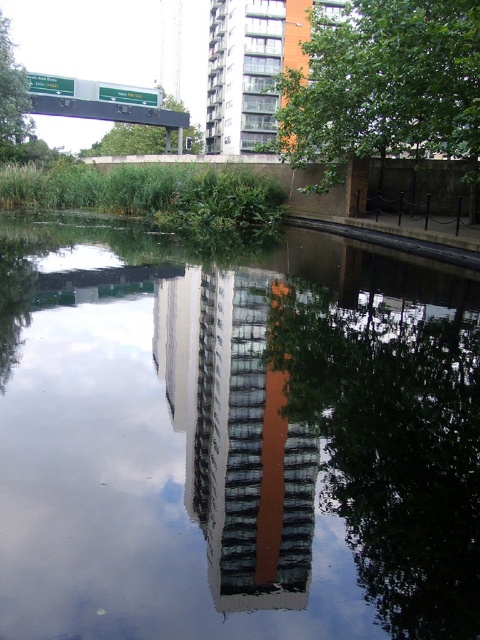
What do you see at coordinates (233, 440) in the screenshot? Image resolution: width=480 pixels, height=640 pixels. I see `transparent glass water at center` at bounding box center [233, 440].

Which is above, transparent glass water at center or green leafy tree at center?

green leafy tree at center is higher up.

Locate an element on the screen. transparent glass water at center is located at coordinates (233, 440).

Is transparent glass water at center positioned in front of green leafy tree at upper left?

Yes, transparent glass water at center is closer to the viewer.

Can you confirm if transparent glass water at center is taller than green leafy tree at upper left?

No.

Does point (120, 372) come closer to viewer compared to point (12, 54)?

That is True.

Where is `transparent glass water at center`? This screenshot has width=480, height=640. transparent glass water at center is located at coordinates coord(233,440).

Is transparent glass water at center taller than green leafy tree at upper center?

In fact, transparent glass water at center may be shorter than green leafy tree at upper center.

Looking at this image, does transparent glass water at center appear on the left side of green leafy tree at upper center?

In fact, transparent glass water at center is to the right of green leafy tree at upper center.

Is point (321, 440) farther from camera compared to point (188, 145)?

That is False.

I want to click on transparent glass water at center, so click(x=233, y=440).